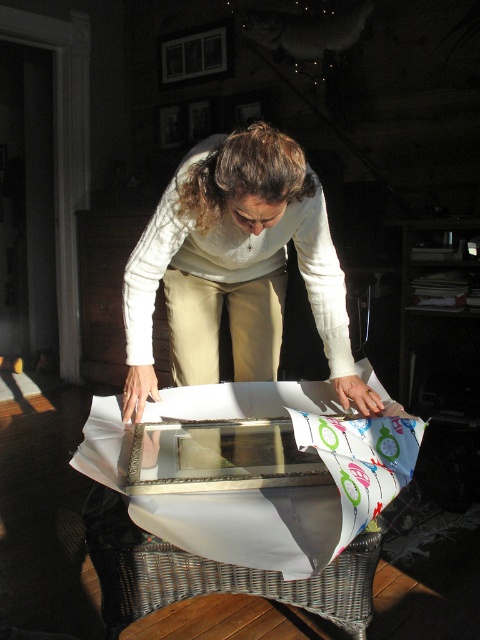
Who is lower down, white sweater at center or white wicker table at center?

Positioned lower is white wicker table at center.

Is white sweater at center thinner than white wicker table at center?

Indeed, white sweater at center has a lesser width compared to white wicker table at center.

Describe the element at coordinates (235, 268) in the screenshot. This screenshot has height=640, width=480. I see `white sweater at center` at that location.

The height and width of the screenshot is (640, 480). I want to click on white sweater at center, so click(x=235, y=268).